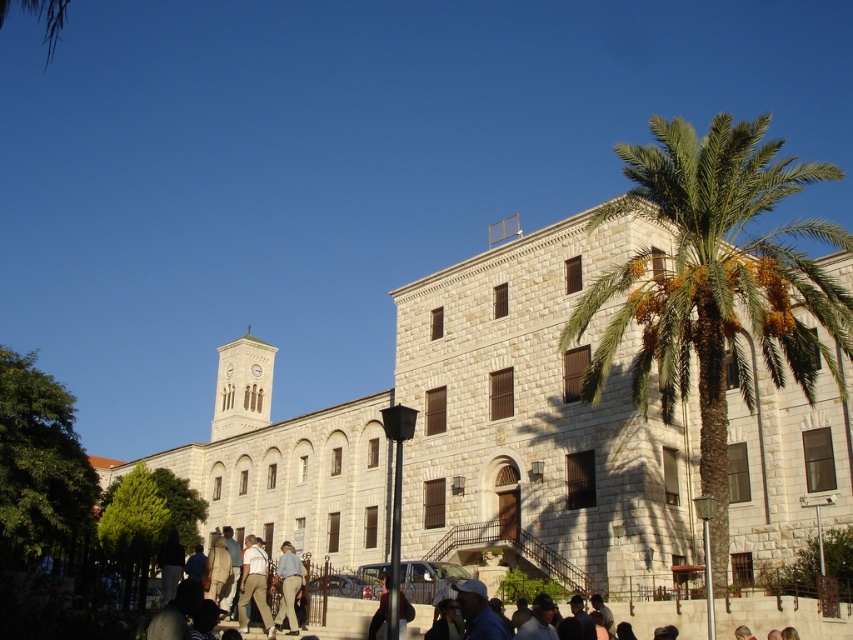
In the scene shown: You are planning to install a new pathway between the white stone church at center and the green leafy palm at center. The pathway must be exactly 30 meters long. Based on the scene description, will the pathway fit between them?

The distance between the white stone church at center and the green leafy palm at center is 35.62 meters. Since the pathway is only 30 meters long, it will not be long enough to span the entire distance between them.

You are standing in front of the white stone church at center and the green leafy palm at center. Which object is located to the right side?

The green leafy palm at center is located to the right side of the white stone church at center.

You are a visitor standing in the paved area in front of the historic stone building. You notice the white stone church at center and the green leafy palm at center. Which object is casting a shadow over the other?

The white stone church at center is positioned under the green leafy palm at center, so the palm is casting its shadow over the church.